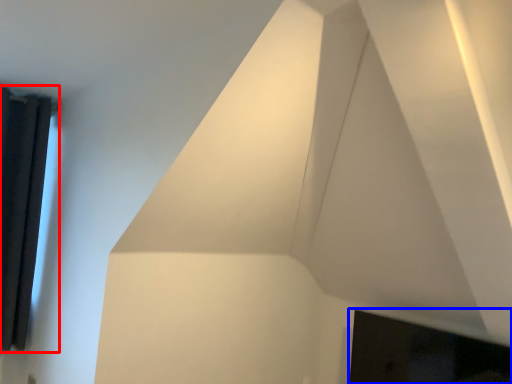
Question: Which object is further to the camera taking this photo, window (highlighted by a red box) or fireplace (highlighted by a blue box)?

Choices:
 (A) window
 (B) fireplace

Answer: (A)